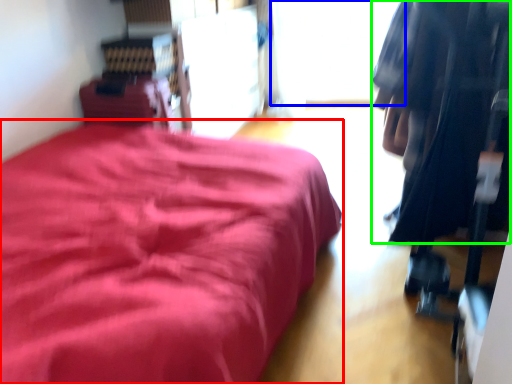
Question: Based on their relative distances, which object is nearer to furniture (highlighted by a red box)? Choose from window (highlighted by a blue box) and clothing (highlighted by a green box).

Choices:
 (A) window
 (B) clothing

Answer: (B)